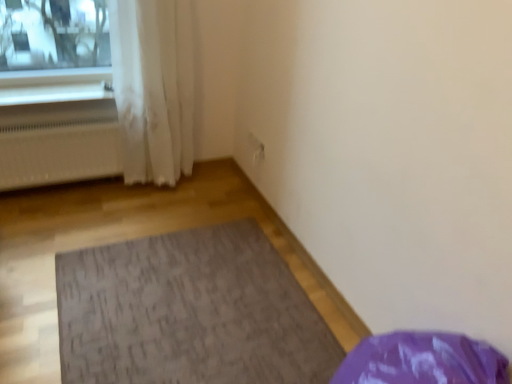
You are a GUI agent. You are given a task and a screenshot of the screen. Output one action in this format:
    pyautogui.click(x=<x>, y=<y>)
    Task: Click on the free spot above textured gray mat at center (from a real-world perspective)
    
    Given the screenshot: What is the action you would take?
    pyautogui.click(x=193, y=298)